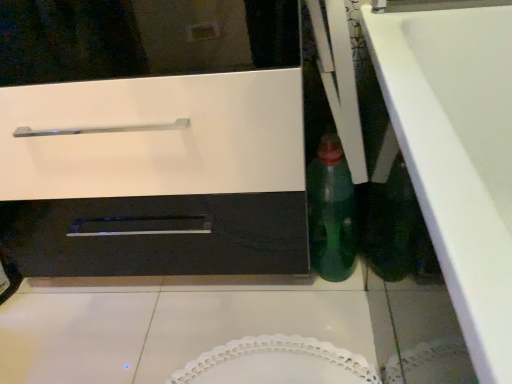
Question: Can you confirm if white glossy oven at center is shorter than white glossy counter top at lower right?

Choices:
 (A) no
 (B) yes

Answer: (A)

Question: From the image's perspective, is white glossy oven at center below white glossy counter top at lower right?

Choices:
 (A) yes
 (B) no

Answer: (B)

Question: Is white glossy oven at center oriented towards white glossy counter top at lower right?

Choices:
 (A) yes
 (B) no

Answer: (B)

Question: Is white glossy oven at center to the left of white glossy counter top at lower right from the viewer's perspective?

Choices:
 (A) no
 (B) yes

Answer: (B)

Question: Can we say white glossy oven at center lies outside white glossy counter top at lower right?

Choices:
 (A) yes
 (B) no

Answer: (A)

Question: Which is correct: green glass bottle at center-right is inside white glossy counter top at lower right, or outside of it?

Choices:
 (A) outside
 (B) inside

Answer: (A)

Question: Considering the positions of point (331, 168) and point (415, 155), is point (331, 168) closer or farther from the camera than point (415, 155)?

Choices:
 (A) farther
 (B) closer

Answer: (A)

Question: Considering the relative positions of green glass bottle at center-right and white glossy counter top at lower right in the image provided, is green glass bottle at center-right to the left or to the right of white glossy counter top at lower right?

Choices:
 (A) left
 (B) right

Answer: (A)

Question: In terms of size, does green glass bottle at center-right appear bigger or smaller than white glossy counter top at lower right?

Choices:
 (A) big
 (B) small

Answer: (B)

Question: In terms of height, does green glass bottle at center-right look taller or shorter compared to white glossy oven at center?

Choices:
 (A) short
 (B) tall

Answer: (A)

Question: Would you say green glass bottle at center-right is inside or outside white glossy oven at center?

Choices:
 (A) inside
 (B) outside

Answer: (B)

Question: From the image's perspective, is green glass bottle at center-right above or below white glossy oven at center?

Choices:
 (A) below
 (B) above

Answer: (A)

Question: Is green glass bottle at center-right bigger or smaller than white glossy oven at center?

Choices:
 (A) small
 (B) big

Answer: (A)

Question: Considering the positions of white glossy counter top at lower right and green glass bottle at center-right in the image, is white glossy counter top at lower right wider or thinner than green glass bottle at center-right?

Choices:
 (A) thin
 (B) wide

Answer: (A)

Question: From a real-world perspective, is white glossy counter top at lower right physically located above or below green glass bottle at center-right?

Choices:
 (A) above
 (B) below

Answer: (A)